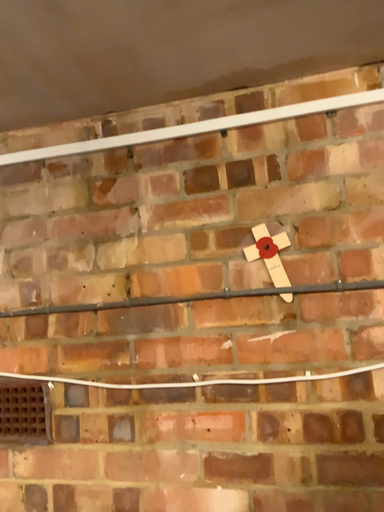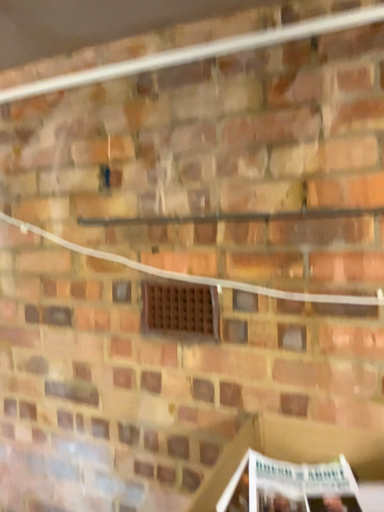
Question: Which way did the camera rotate in the video?

Choices:
 (A) rotated upward
 (B) rotated downward

Answer: (B)